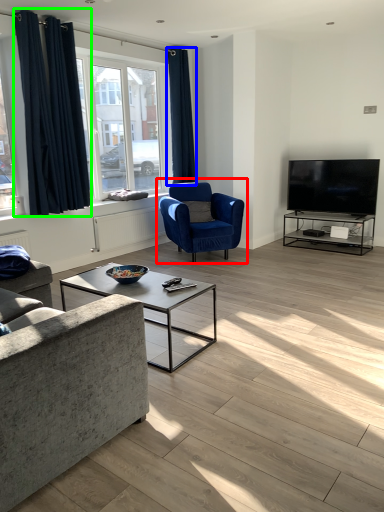
Question: Which is nearer to the chair (highlighted by a red box)? curtain (highlighted by a blue box) or curtain (highlighted by a green box).

Choices:
 (A) curtain
 (B) curtain

Answer: (A)